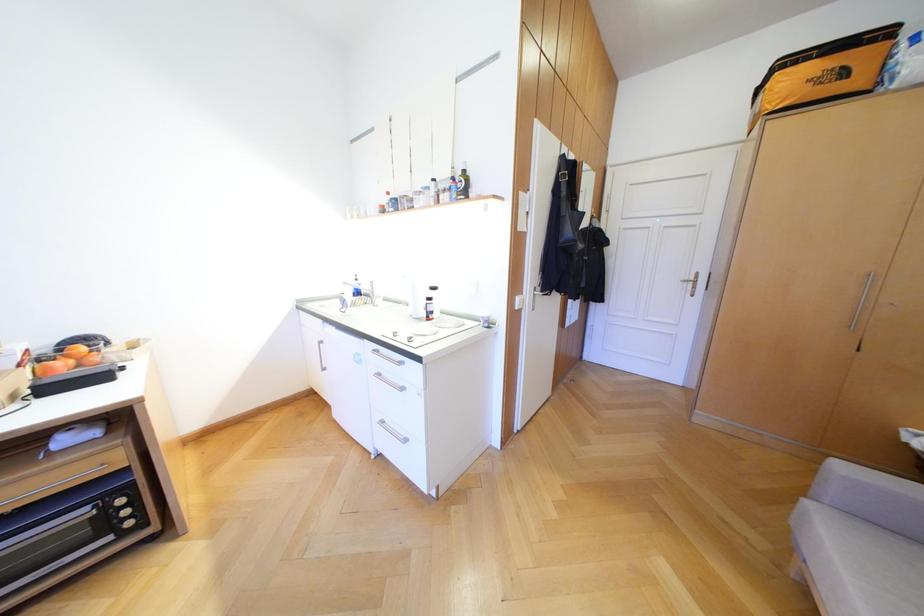
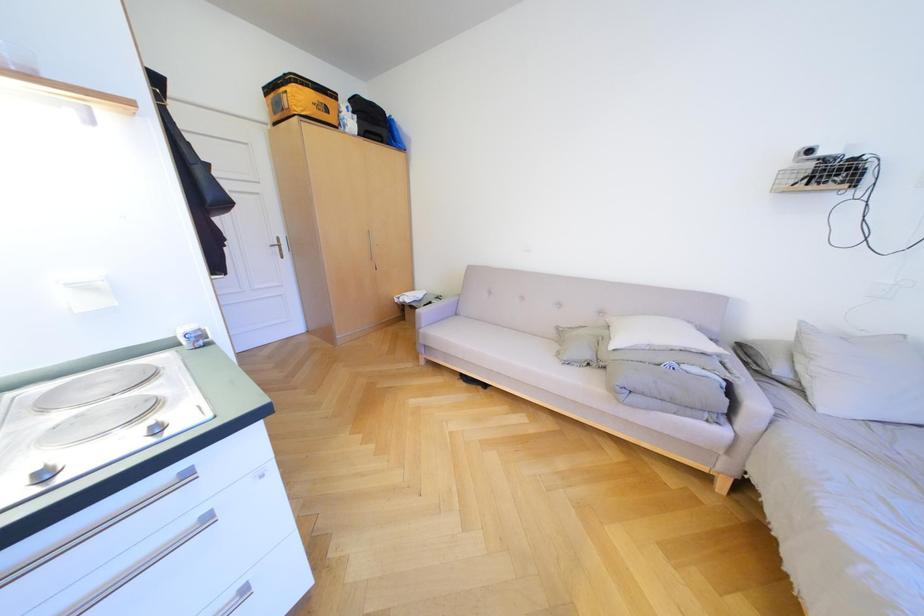
First-person continuous shooting, in which direction is the camera rotating?

The camera's rotation is toward right-down.